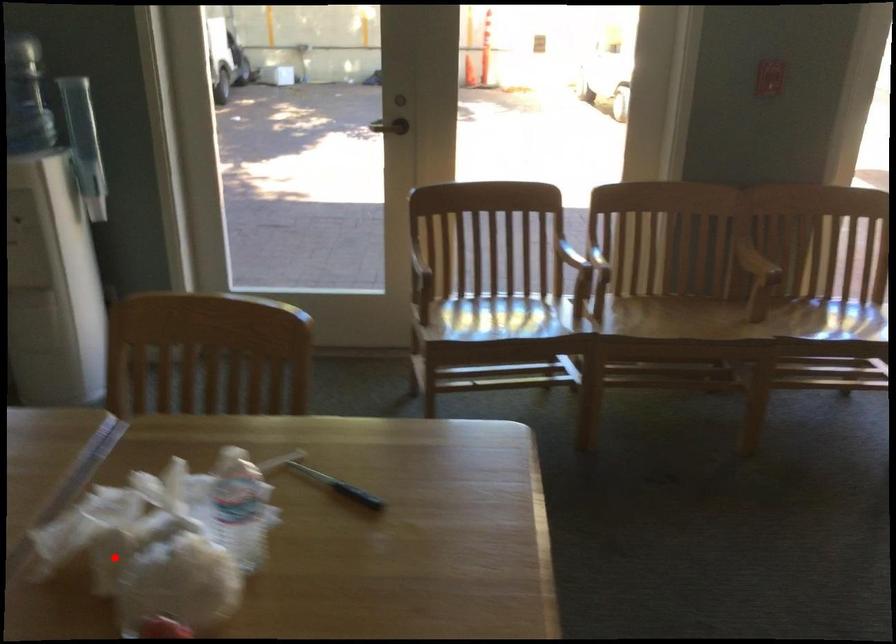
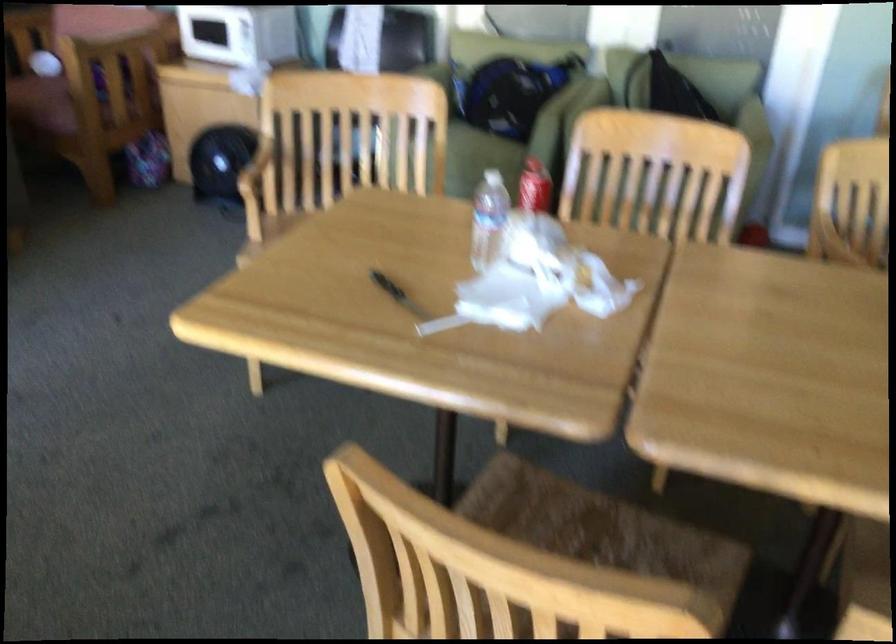
In the second image, find the point that corresponds to the highlighted location in the first image.

(487, 218)